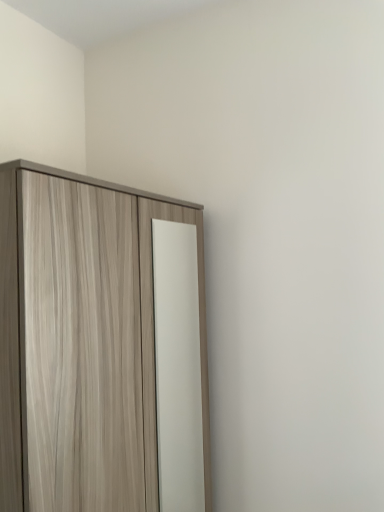
Find the location of a particular element. light wood cupboard at center is located at coordinates [x=129, y=338].

What do you see at coordinates (129, 338) in the screenshot? I see `light wood cupboard at center` at bounding box center [129, 338].

What is the approximate width of light wood cupboard at center?

light wood cupboard at center is 59.84 centimeters wide.

Locate an element on the screen. This screenshot has width=384, height=512. light wood cupboard at center is located at coordinates (129, 338).